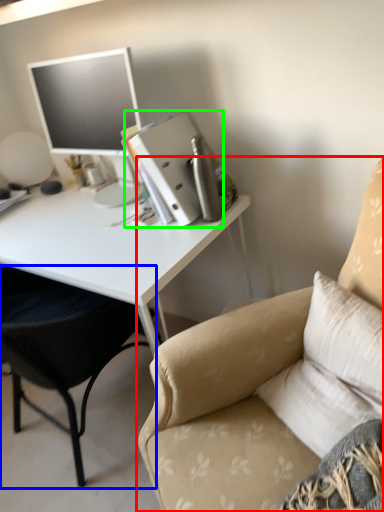
Question: Which object is positioned farthest from chair (highlighted by a red box)? Select from chair (highlighted by a blue box) and binder (highlighted by a green box).

Choices:
 (A) chair
 (B) binder

Answer: (B)